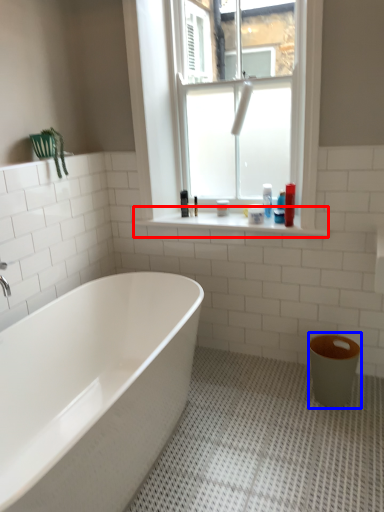
Question: Which of the following is the closest to the observer, window sill (highlighted by a red box) or toilet bowl (highlighted by a blue box)?

Choices:
 (A) window sill
 (B) toilet bowl

Answer: (B)